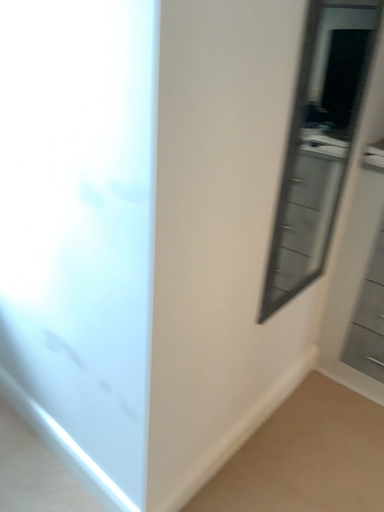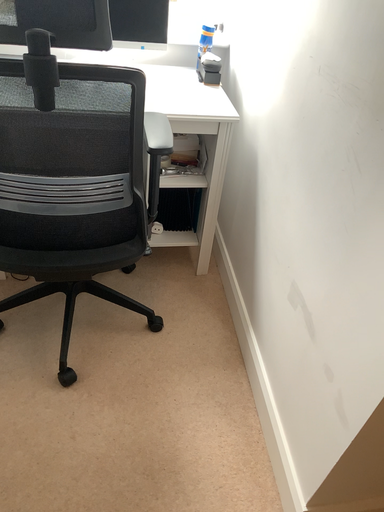
Question: Which way did the camera rotate in the video?

Choices:
 (A) rotated right
 (B) rotated left

Answer: (B)